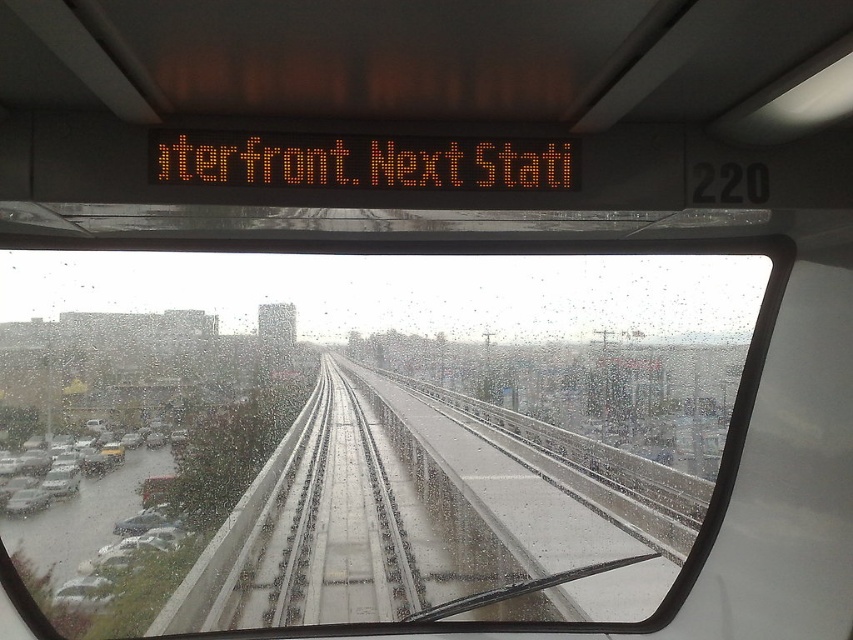
You are a passenger on the train and want to take a photo of the parking lot on the left side of the tracks through the transparent glass windshield at center. Is the parking lot visible through the windshield?

The transparent glass windshield at center is located at point (363, 433), which is the central area of the window. Since the windshield is transparent and the parking lot is on the left side of the tracks, the passenger can see the parking lot through the windshield as long as their line of sight aligns with the parking lot. However, the windshield position might require the passenger to adjust their angle to ensure the parking lot is within the visible area.

You are inside the train and want to see the outside view clearly. Which object at point (363, 433) can help you see through?

The transparent glass windshield at center located at point (363, 433) allows clear visibility, so you can see the outside view through it.

You are a passenger on the train and want to know if the transparent glass windshield at center can fully frame the matte silver car at lower left in your phone camera. Can it?

The transparent glass windshield at center is wider than the matte silver car at lower left, so the matte silver car at lower left can be fully framed within the transparent glass windshield at center.